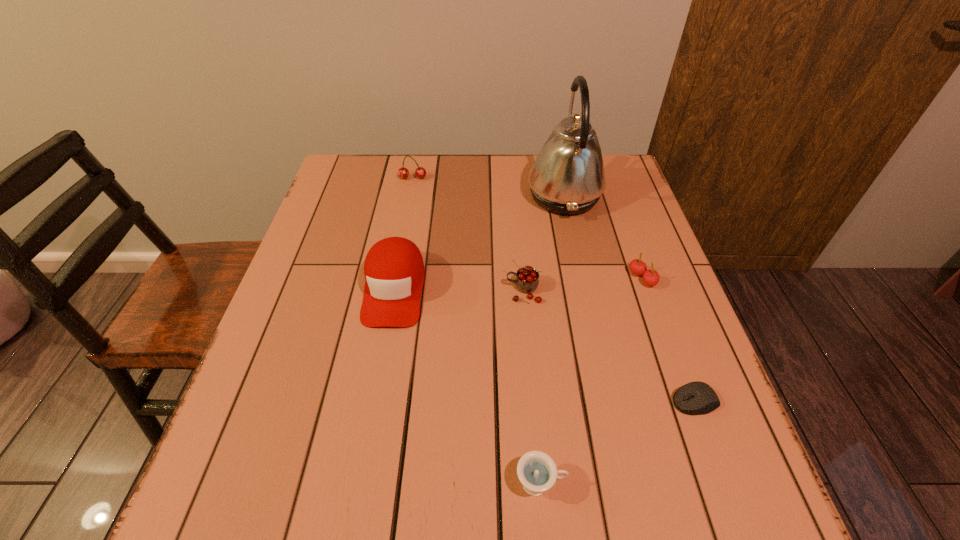
Where is `the fourth closest object to the kettle`? the fourth closest object to the kettle is located at coordinates (420, 172).

Image resolution: width=960 pixels, height=540 pixels. Find the location of `cherry that is the third closest one to the computer equipment`. cherry that is the third closest one to the computer equipment is located at coordinates (420, 172).

Image resolution: width=960 pixels, height=540 pixels. In order to click on the second closest cherry relative to the baseball cap in this screenshot , I will do `click(420, 172)`.

Find the location of a particular element. The height and width of the screenshot is (540, 960). free space that satisfies the following two spatial constraints: 1. on the handle side of the rightmost cherry; 2. on the right side of the second cherry from left to right is located at coordinates coord(522,279).

Image resolution: width=960 pixels, height=540 pixels. Identify the location of free point that satisfies the following two spatial constraints: 1. on the front-facing side of the baseball cap; 2. on the right side of the computer equipment. (373, 401).

Locate an element on the screen. vacant region that satisfies the following two spatial constraints: 1. with stems pointing upwards on the shortest object; 2. on the right side of the farthest cherry is located at coordinates (371, 401).

You are a GUI agent. You are given a task and a screenshot of the screen. Output one action in this format:
    pyautogui.click(x=<x>, y=<y>)
    Task: Click on the free spot that satisfies the following two spatial constraints: 1. from the spout of the tallest object; 2. on the back side of the rightmost cherry
    This screenshot has width=960, height=540.
    Given the screenshot: What is the action you would take?
    pyautogui.click(x=582, y=279)

At what (x,y) coordinates should I click in order to perform the action: click on free space that satisfies the following two spatial constraints: 1. from the spout of the computer equipment; 2. on the right side of the kettle. Please return your answer as a coordinate pair (x, y). The height and width of the screenshot is (540, 960). Looking at the image, I should click on (610, 401).

The width and height of the screenshot is (960, 540). In order to click on vacant area that satisfies the following two spatial constraints: 1. from the spout of the tallest object; 2. on the right side of the sixth farthest object in this screenshot , I will do `click(610, 401)`.

Image resolution: width=960 pixels, height=540 pixels. I want to click on free location that satisfies the following two spatial constraints: 1. on the front-facing side of the sixth farthest object; 2. on the left side of the baseball cap, so click(x=373, y=401).